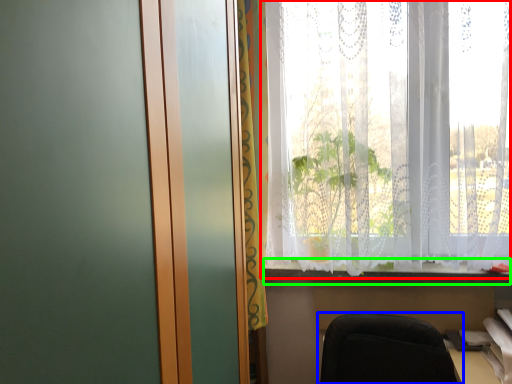
Question: Considering the real-world distances, which object is closest to window (highlighted by a red box)? chair (highlighted by a blue box) or window sill (highlighted by a green box).

Choices:
 (A) chair
 (B) window sill

Answer: (B)